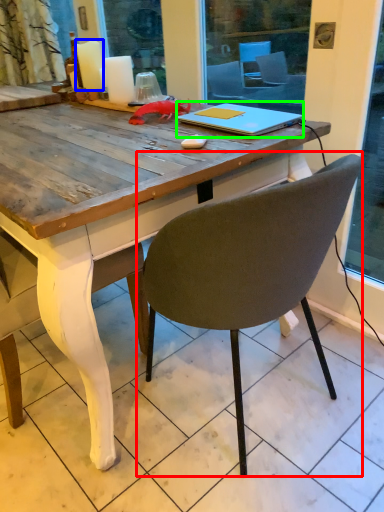
Question: Considering the real-world distances, which object is farthest from chair (highlighted by a red box)? candle (highlighted by a blue box) or notebook (highlighted by a green box)?

Choices:
 (A) candle
 (B) notebook

Answer: (A)